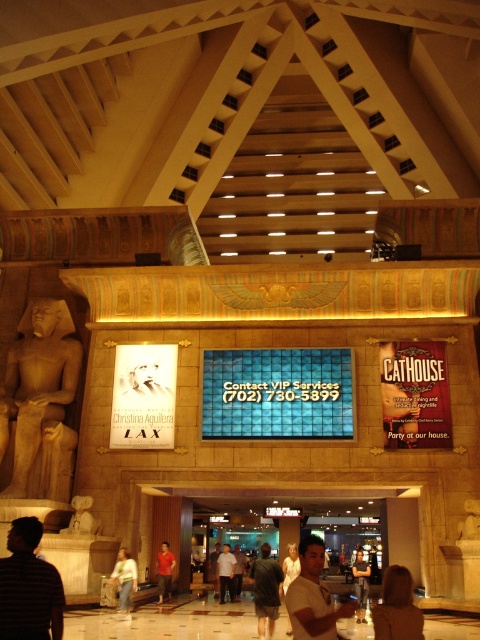
Does white t-shirt at center appear over orange t-shirt at center?

Indeed, white t-shirt at center is positioned over orange t-shirt at center.

Can you confirm if white t-shirt at center is thinner than orange t-shirt at center?

No.

Is point (296, 627) closer to viewer compared to point (162, 566)?

Yes, point (296, 627) is closer to viewer.

The height and width of the screenshot is (640, 480). I want to click on white t-shirt at center, so click(313, 596).

Between blonde hair at lower right and matte white statue at lower left, which one is positioned lower?

Positioned lower is blonde hair at lower right.

The image size is (480, 640). What do you see at coordinates (396, 608) in the screenshot? I see `blonde hair at lower right` at bounding box center [396, 608].

Identify the location of blonde hair at lower right. (396, 608).

Does point (25, 438) come farther from viewer compared to point (119, 560)?

That is True.

Is the position of polished beige statue at left less distant than that of light brown leather pants at lower left?

No, it is not.

Describe the element at coordinates (40, 400) in the screenshot. I see `polished beige statue at left` at that location.

Locate an element on the screen. Image resolution: width=480 pixels, height=640 pixels. polished beige statue at left is located at coordinates point(40,400).